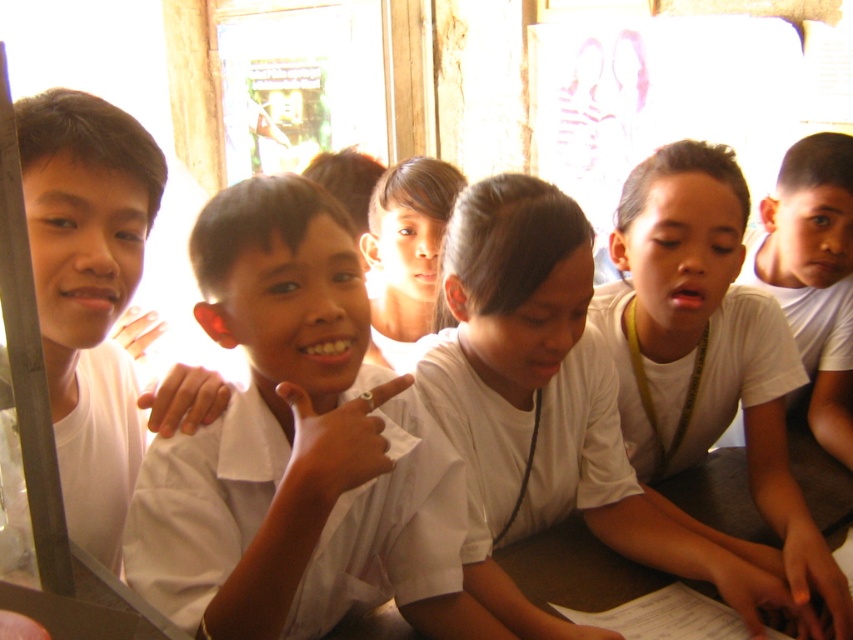
You are a photographer standing in front of the children in the classroom. You want to take a photo that focuses on both point (387,496) and point (399,289). Which point should you adjust your focus to ensure both are in sharp focus?

To ensure both points are in sharp focus, you should adjust your focus to the point that is farther from the camera, which is point (399,289). This is because the depth of field will extend from that point backward, potentially including the closer point within the focused area.

You are standing in the classroom and want to place a small plant between the two points, point (780,429) and point (405,275). Since the plant needs to be placed closer to the point that is farther away from you, which point should you choose?

You should choose point (405,275) because it is farther away from you than point (780,429), so placing the plant closer to that point meets the requirement.

You are a photographer standing behind the children in the classroom scene. You want to take a photo of the white smooth shirt at center and the white matte shirt at right. Can you clearly see both shirts in your camera viewfinder without any obstruction?

The white smooth shirt at center is in front of the white matte shirt at right, so the white matte shirt at right may be partially or fully blocked from view. Therefore, you might not be able to clearly see both shirts without moving the camera angle or adjusting the childrens positions.